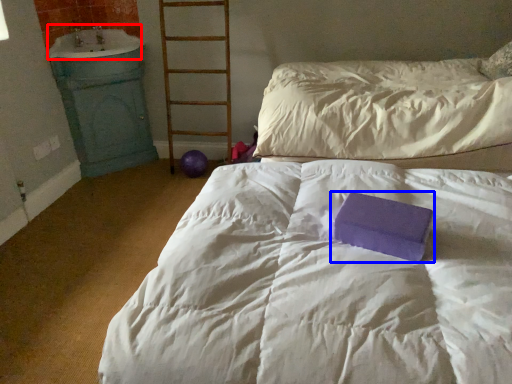
Question: Which object appears farthest to the camera in this image, sink (highlighted by a red box) or paperback book (highlighted by a blue box)?

Choices:
 (A) sink
 (B) paperback book

Answer: (A)